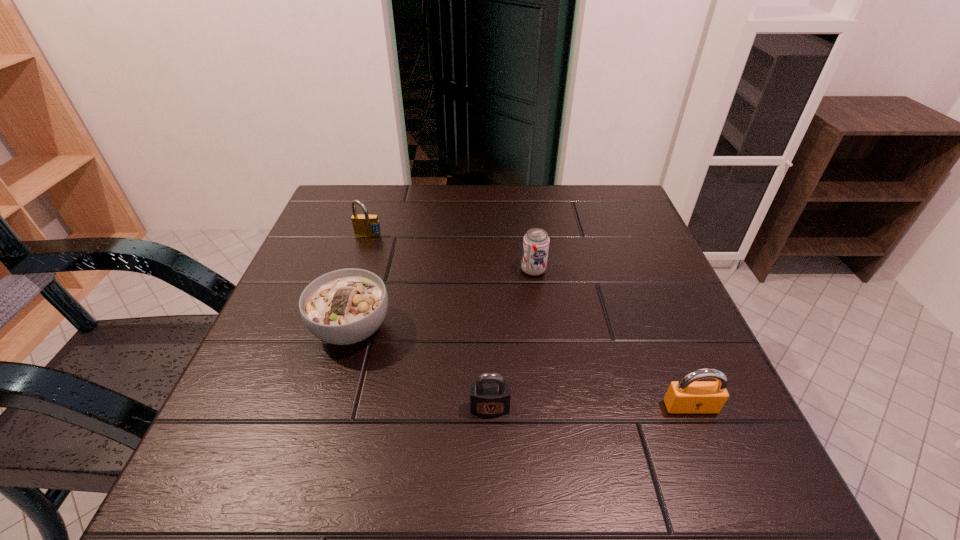
The image size is (960, 540). I want to click on the leftmost padlock, so click(364, 225).

Identify the location of the farthest padlock. (364, 225).

Where is `beer can`? This screenshot has height=540, width=960. beer can is located at coordinates (536, 241).

Where is `the second object from right to left`? The width and height of the screenshot is (960, 540). the second object from right to left is located at coordinates (536, 241).

Locate an element on the screen. the rightmost object is located at coordinates (687, 395).

Where is `the third nearest object`? This screenshot has width=960, height=540. the third nearest object is located at coordinates (346, 306).

This screenshot has width=960, height=540. I want to click on the second padlock from right to left, so [x=489, y=398].

Image resolution: width=960 pixels, height=540 pixels. I want to click on vacant region located on the side with the combination dials of the farthest object, so click(358, 268).

At what (x,y) coordinates should I click in order to perform the action: click on blank space located 0.230m on the left of the fourth object from left to right. Please return your answer as a coordinate pair (x, y). Looking at the image, I should click on (420, 270).

Locate an element on the screen. vacant space located to unlock the rightmost padlock from the front is located at coordinates [724, 489].